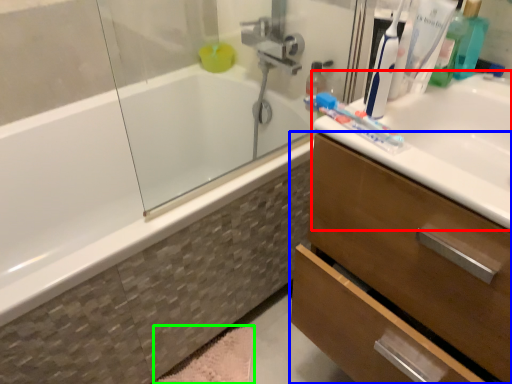
Question: Which object is the closest to the sink (highlighted by a red box)? Choose among these: bathroom cabinet (highlighted by a blue box) or bath mat (highlighted by a green box).

Choices:
 (A) bathroom cabinet
 (B) bath mat

Answer: (A)